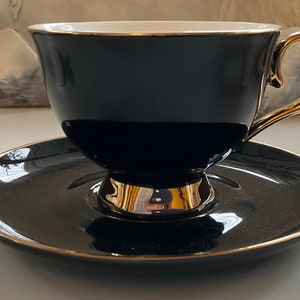
Identify the location of cup. (187, 138).